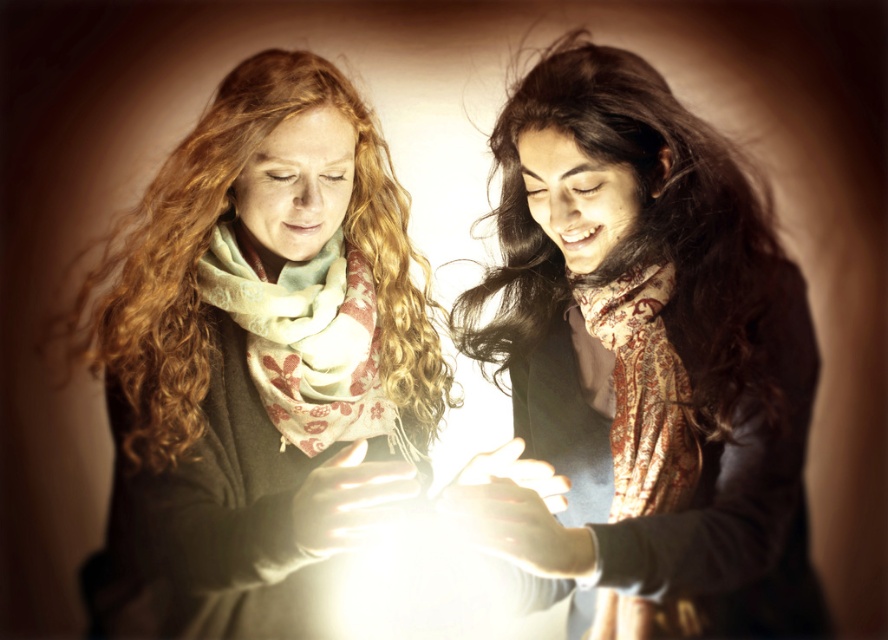
You are a fashion stylist observing two scarves in an image. The first is a matte green scarf at center, and the second is a brown paisley scarf at center. Which scarf is positioned to the left?

The matte green scarf at center is positioned to the left of the brown paisley scarf at center.

You are an observer trying to locate the matte green scarf at center in the image. According to the coordinates provided, where would you look to find it?

The matte green scarf at center is located at coordinates point (260, 364).

You are an observer looking at the scene. There are two scarves visible in the image. The first is a matte green scarf at center, and the second is a patterned silk scarf at right. Which scarf is positioned higher in the image?

The matte green scarf at center is positioned higher in the image than the patterned silk scarf at right.